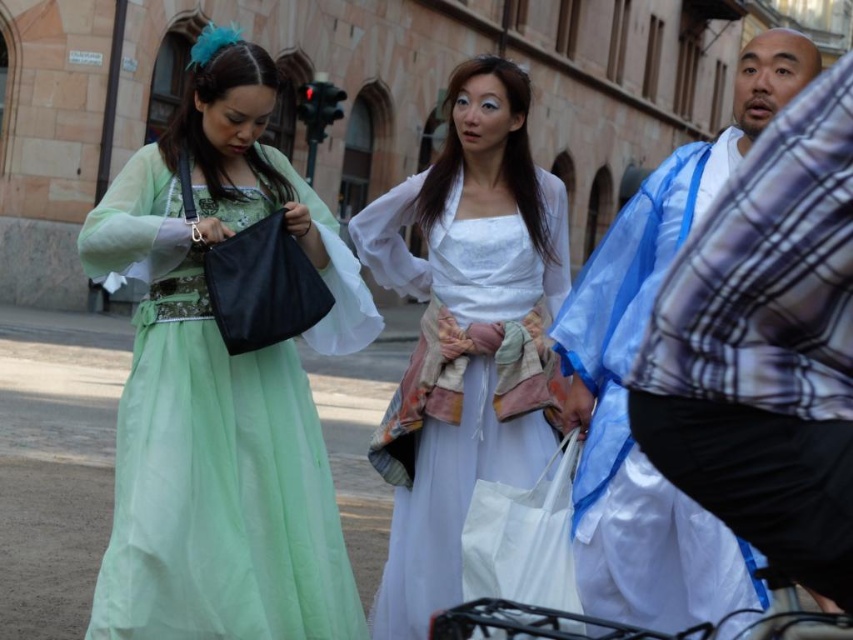
Question: Among these objects, which one is nearest to the camera?

Choices:
 (A) white sheer dress at center
 (B) blue silk kimono at right
 (C) matte green dress at center

Answer: (B)

Question: Among these objects, which one is farthest from the camera?

Choices:
 (A) white fabric bag at center
 (B) white sheer dress at center
 (C) matte green dress at center

Answer: (B)

Question: Which point is farther from the camera taking this photo?

Choices:
 (A) (482, 632)
 (B) (641, 484)
 (C) (334, 259)
 (D) (439, 259)

Answer: (D)

Question: In this image, where is white sheer dress at center located relative to white fabric bag at center?

Choices:
 (A) below
 (B) above

Answer: (B)

Question: Can you confirm if matte green dress at center is bigger than white sheer dress at center?

Choices:
 (A) no
 (B) yes

Answer: (B)

Question: Does matte green dress at center have a lesser width compared to white sheer dress at center?

Choices:
 (A) no
 (B) yes

Answer: (A)